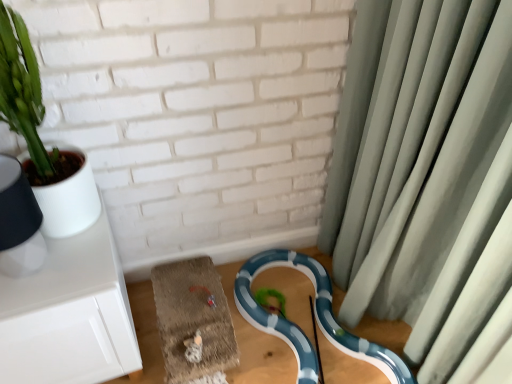
Measure the distance between blue glossy snake at lower center and camera.

4.36 feet.

What do you see at coordinates (416, 156) in the screenshot?
I see `green fabric curtain at right` at bounding box center [416, 156].

Where is `blue glossy snake at lower center`? Image resolution: width=512 pixels, height=384 pixels. blue glossy snake at lower center is located at coordinates (315, 316).

Measure the distance from green matte plant at upper left to green fabric curtain at right.

A distance of 34.08 inches exists between green matte plant at upper left and green fabric curtain at right.

Based on the photo, based on their sizes in the image, would you say green matte plant at upper left is bigger or smaller than green fabric curtain at right?

Considering their sizes, green matte plant at upper left takes up less space than green fabric curtain at right.

Is green fabric curtain at right located within green matte plant at upper left?

No, green fabric curtain at right is not a part of green matte plant at upper left.

Considering the relative sizes of blue glossy snake at lower center and green fabric curtain at right in the image provided, is blue glossy snake at lower center smaller than green fabric curtain at right?

Indeed, blue glossy snake at lower center has a smaller size compared to green fabric curtain at right.

From the picture: Would you say blue glossy snake at lower center is outside green fabric curtain at right?

Yes, blue glossy snake at lower center is outside of green fabric curtain at right.

Which is in front, point (248, 283) or point (379, 275)?

The point (379, 275) is closer.

Considering the sizes of objects blue glossy snake at lower center and green fabric curtain at right in the image provided, who is shorter, blue glossy snake at lower center or green fabric curtain at right?

blue glossy snake at lower center is shorter.

Which is more to the left, green fabric curtain at right or blue glossy snake at lower center?

blue glossy snake at lower center.

Based on the photo, could you tell me if green fabric curtain at right is facing blue glossy snake at lower center?

Yes, green fabric curtain at right is turned towards blue glossy snake at lower center.

Can blue glossy snake at lower center be found inside green fabric curtain at right?

No, blue glossy snake at lower center is not inside green fabric curtain at right.

Considering the relative sizes of green fabric curtain at right and blue glossy snake at lower center in the image provided, is green fabric curtain at right shorter than blue glossy snake at lower center?

No, green fabric curtain at right is not shorter than blue glossy snake at lower center.

From a real-world perspective, between green matte plant at upper left and blue glossy snake at lower center, who is vertically lower?

From a 3D spatial view, blue glossy snake at lower center is below.

Considering the points (15, 99) and (250, 319), which point is behind, point (15, 99) or point (250, 319)?

The point (250, 319) is farther.

Who is bigger, green matte plant at upper left or blue glossy snake at lower center?

A: green matte plant at upper left is bigger.

Between green matte plant at upper left and blue glossy snake at lower center, which one has larger width?

With larger width is blue glossy snake at lower center.

Which object is positioned more to the left, green fabric curtain at right or green matte plant at upper left?

green matte plant at upper left is more to the left.

Does green fabric curtain at right have a lesser width compared to green matte plant at upper left?

No, green fabric curtain at right is not thinner than green matte plant at upper left.

Which object is further away from the camera, green fabric curtain at right or green matte plant at upper left?

green matte plant at upper left is more distant.

Is green fabric curtain at right aimed at green matte plant at upper left?

Yes, green fabric curtain at right is oriented towards green matte plant at upper left.

In the scene shown: Is blue glossy snake at lower center not within green matte plant at upper left?

blue glossy snake at lower center lies outside green matte plant at upper left's area.

Is blue glossy snake at lower center with green matte plant at upper left?

They are not placed beside each other.

Does point (310, 373) come in front of point (58, 202)?

No, (310, 373) is behind (58, 202).

Between blue glossy snake at lower center and green matte plant at upper left, which one has larger size?

green matte plant at upper left.

Locate an element on the screen. The height and width of the screenshot is (384, 512). curtain to the right of green matte plant at upper left is located at coordinates (416, 156).

Where is `curtain above the blue glossy snake at lower center (from a real-world perspective)`? The image size is (512, 384). curtain above the blue glossy snake at lower center (from a real-world perspective) is located at coordinates (416, 156).

From the picture: Which object lies further to the anchor point green fabric curtain at right, green matte plant at upper left or blue glossy snake at lower center?

green matte plant at upper left is positioned further to the anchor green fabric curtain at right.

Which object lies nearer to the anchor point blue glossy snake at lower center, green matte plant at upper left or green fabric curtain at right?

A: green fabric curtain at right is closer to blue glossy snake at lower center.

Based on their spatial positions, is green fabric curtain at right or green matte plant at upper left further from blue glossy snake at lower center?

Based on the image, green matte plant at upper left appears to be further to blue glossy snake at lower center.

Which object lies further to the anchor point green fabric curtain at right, blue glossy snake at lower center or green matte plant at upper left?

Among the two, green matte plant at upper left is located further to green fabric curtain at right.

When comparing their distances from green matte plant at upper left, does blue glossy snake at lower center or green fabric curtain at right seem further?

green fabric curtain at right.

From the picture: Which object lies further to the anchor point green matte plant at upper left, green fabric curtain at right or blue glossy snake at lower center?

green fabric curtain at right is positioned further to the anchor green matte plant at upper left.

Locate an element on the screen. The image size is (512, 384). snake situated between green matte plant at upper left and green fabric curtain at right from left to right is located at coordinates (315, 316).